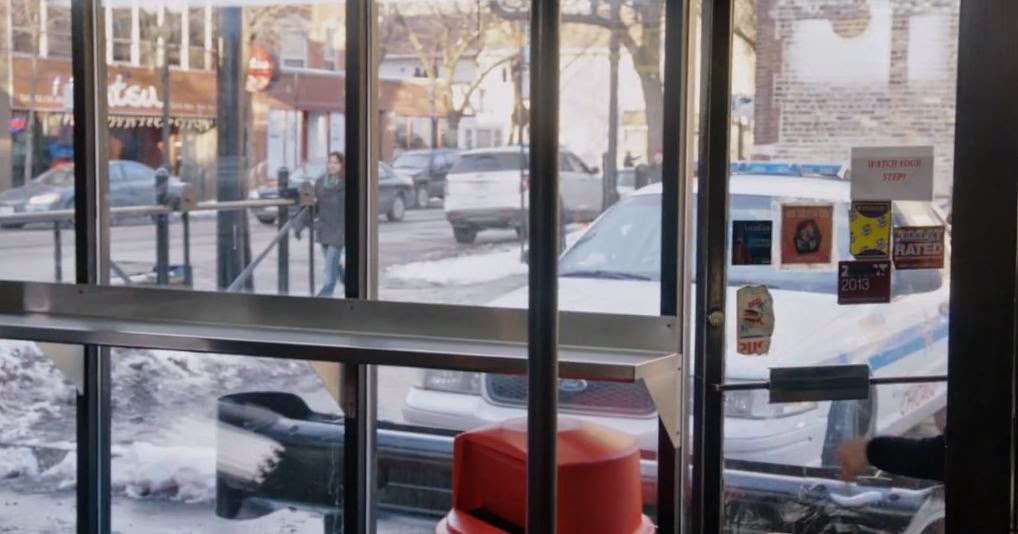
Locate an element on the screen. glass is located at coordinates [x=796, y=93], [x=593, y=92], [x=419, y=130], [x=266, y=133], [x=150, y=121], [x=42, y=120], [x=50, y=430], [x=217, y=456], [x=406, y=444].